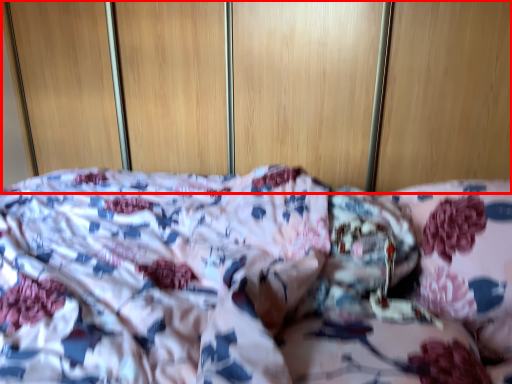
Question: From the image, what is the correct spatial relationship of dresser (annotated by the red box) in relation to pillow?

Choices:
 (A) left
 (B) right

Answer: (A)